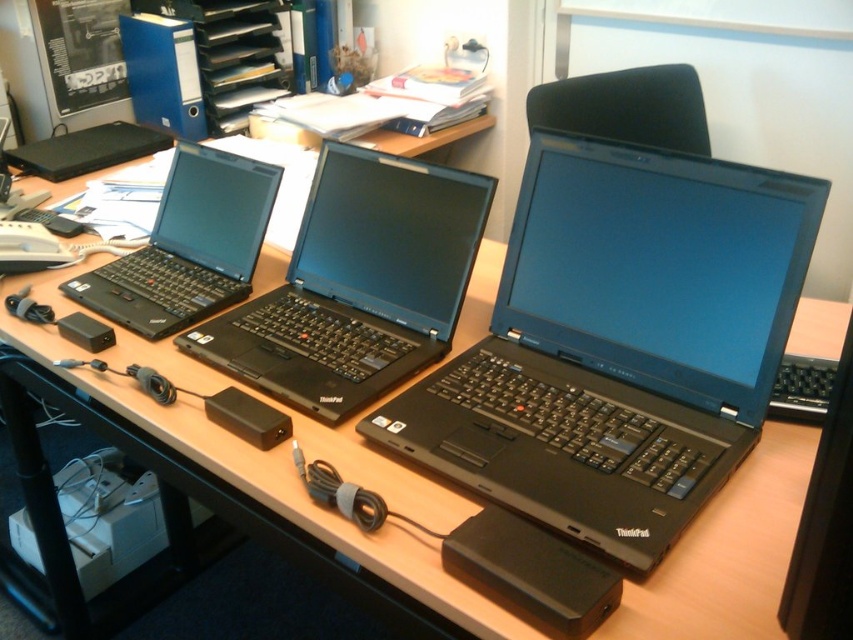
Question: Can you confirm if black matte laptop at center is positioned to the left of black matte laptop at left?

Choices:
 (A) yes
 (B) no

Answer: (B)

Question: From the image, what is the correct spatial relationship of black matte laptop at center in relation to black matte laptop at left?

Choices:
 (A) left
 (B) right

Answer: (B)

Question: Which of the following is the closest to the observer?

Choices:
 (A) (469, 232)
 (B) (572, 301)

Answer: (B)

Question: Considering the real-world distances, which object is closest to the matte black laptop at center?

Choices:
 (A) black matte laptop at center
 (B) black matte laptop at left

Answer: (A)

Question: Can you confirm if matte black laptop at center is smaller than black matte laptop at left?

Choices:
 (A) no
 (B) yes

Answer: (A)

Question: Estimate the real-world distances between objects in this image. Which object is closer to the black matte laptop at center?

Choices:
 (A) black matte laptop at left
 (B) matte black laptop at center

Answer: (A)